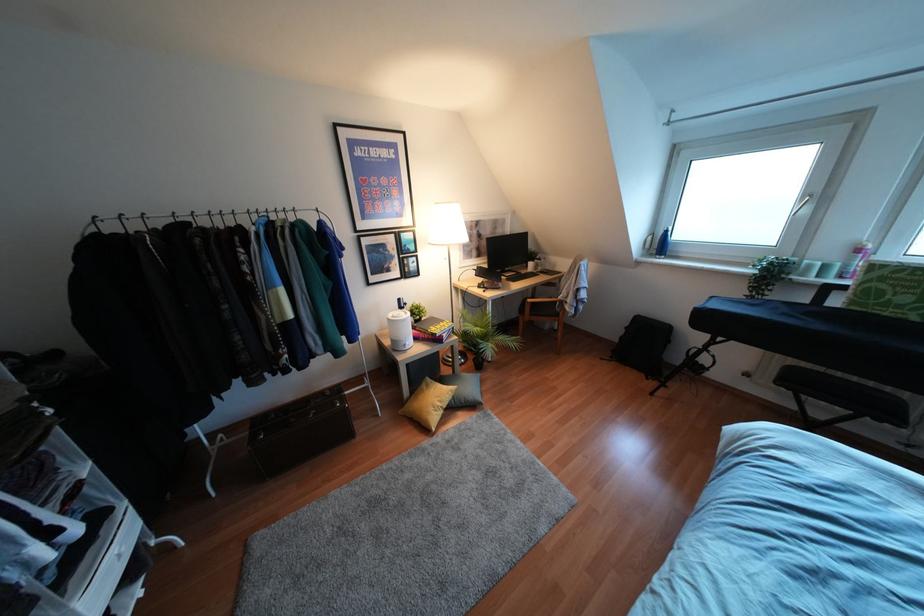
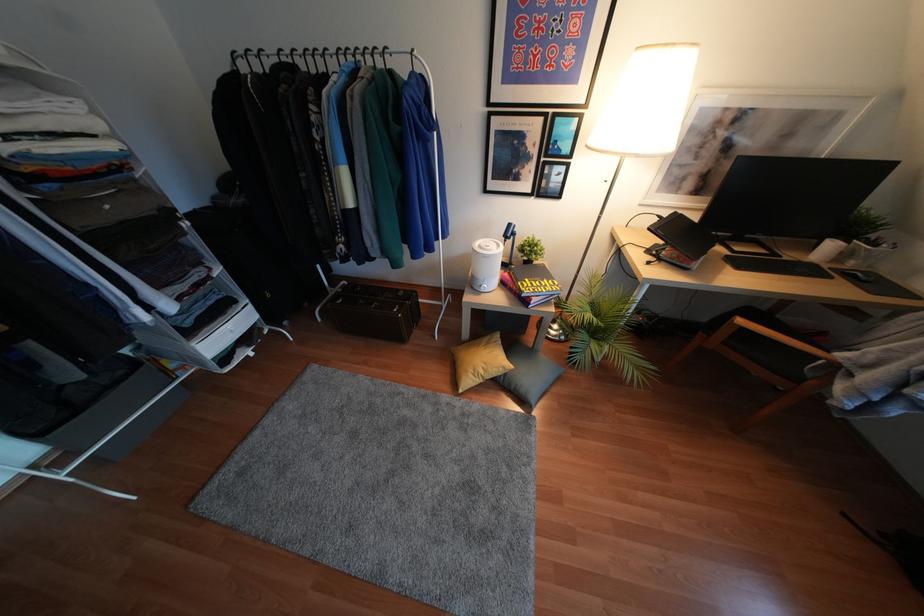
Find the pixel in the second image that matches (407,347) in the first image.

(481, 290)